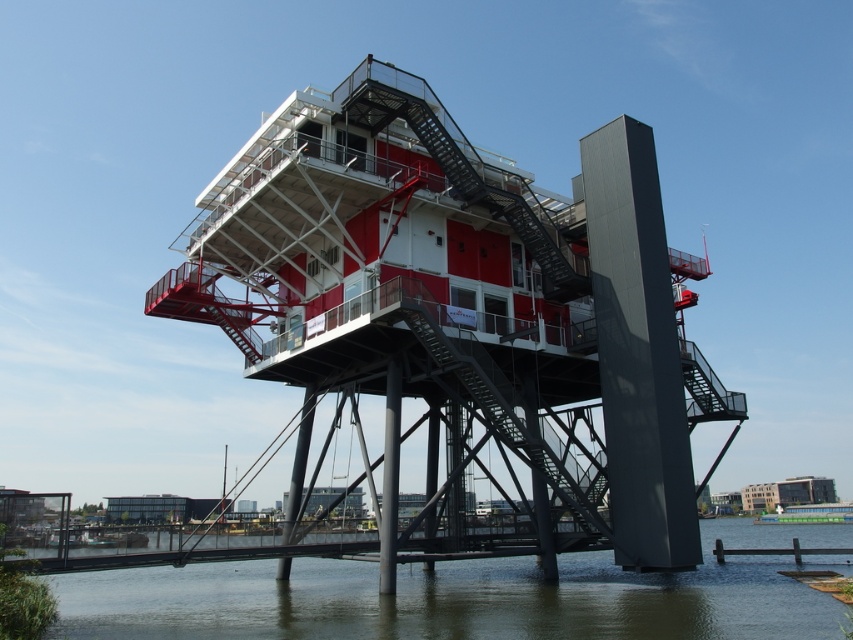
Based on the coordinates provided, which object is located at point (x=463, y=301) in the image?

The point (x=463, y=301) indicates the metallic red observation tower at center.

You are a visitor standing on the shore looking at the metallic red observation tower at center and the green murky water at lower center. Which object takes up more space in the image?

The metallic red observation tower at center is larger in size than the green murky water at lower center, so it takes up more space in the image.